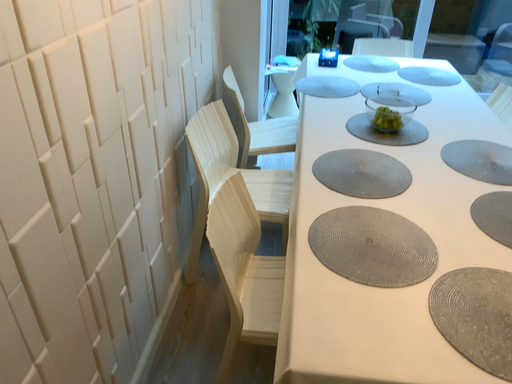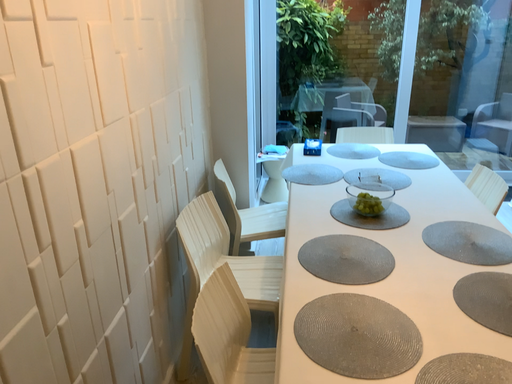
Question: How did the camera likely rotate when shooting the video?

Choices:
 (A) rotated upward
 (B) rotated downward

Answer: (A)